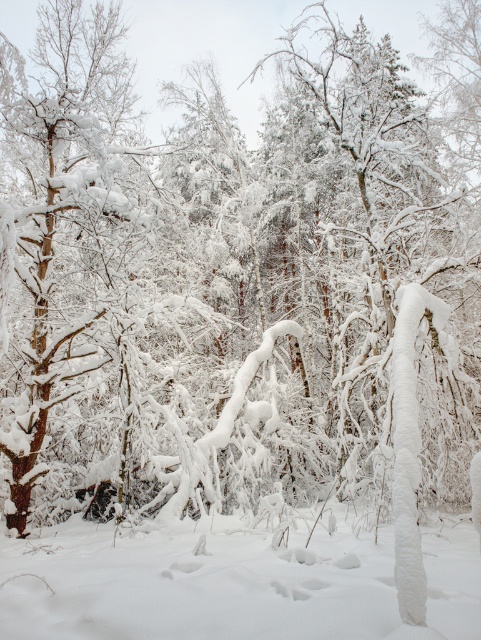
You are planning to build a snowman using the white fluffy snow at center and want to place it near the brown rough tree trunk at left. Based on their sizes, will the snowman be wider than the tree trunk?

The white fluffy snow at center has a width less than the brown rough tree trunk at left, so the snowman made from it will be narrower than the tree trunk.

You are standing in the winter forest and see the white fluffy snow at center and the brown rough tree trunk at left. Which object is located to the right of the other?

The white fluffy snow at center is positioned on the right side of brown rough tree trunk at left.